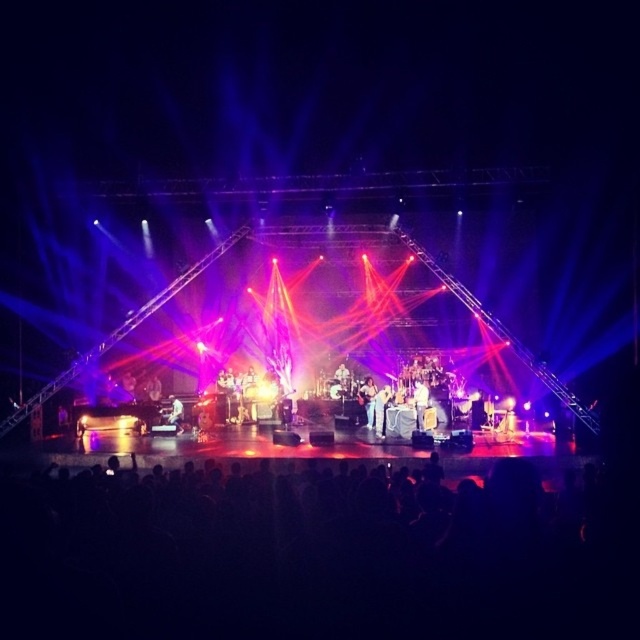
Question: Can you confirm if denim pants at center is smaller than white fabric shirt at center?

Choices:
 (A) no
 (B) yes

Answer: (A)

Question: Which point is farther from the camera taking this photo?

Choices:
 (A) (358, 400)
 (B) (179, 412)

Answer: (A)

Question: Does denim pants at center lie behind white fabric shirt at center?

Choices:
 (A) yes
 (B) no

Answer: (A)

Question: Which of the following is the closest to the observer?

Choices:
 (A) denim pants at center
 (B) white fabric shirt at center

Answer: (B)

Question: Is denim pants at center below white fabric shirt at center?

Choices:
 (A) no
 (B) yes

Answer: (A)